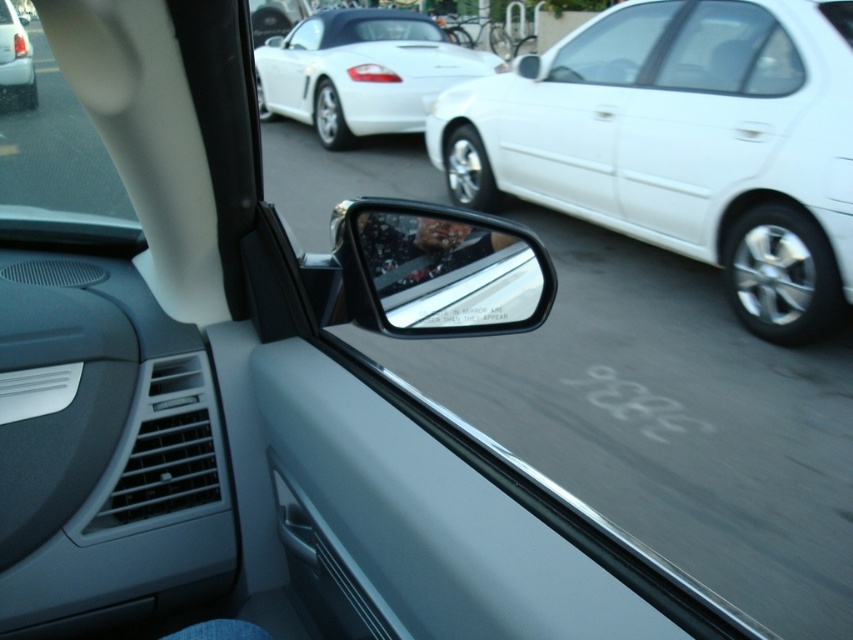
Does clear glass mirror at center appear over clear glass car window at upper right?

Incorrect, clear glass mirror at center is not positioned above clear glass car window at upper right.

Find the location of a particular element. Image resolution: width=853 pixels, height=640 pixels. clear glass mirror at center is located at coordinates pos(438,269).

Locate an element on the screen. The image size is (853, 640). clear glass mirror at center is located at coordinates (438, 269).

In the scene shown: Is the position of clear glass mirror at center less distant than that of transparent plastic car window at upper left?

No, it is not.

Can you confirm if clear glass mirror at center is positioned below transparent plastic car window at upper left?

Indeed, clear glass mirror at center is positioned under transparent plastic car window at upper left.

Where is `clear glass mirror at center`? clear glass mirror at center is located at coordinates (438, 269).

This screenshot has height=640, width=853. Identify the location of clear glass mirror at center. (438, 269).

Which is below, clear glass mirror at center or white glossy convertible at upper center?

clear glass mirror at center is lower down.

Does point (416, 230) come in front of point (416, 104)?

Yes, point (416, 230) is closer to viewer.

The width and height of the screenshot is (853, 640). Find the location of `clear glass mirror at center`. clear glass mirror at center is located at coordinates (438, 269).